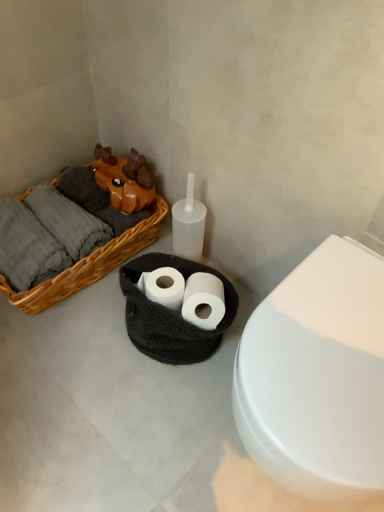
You are a GUI agent. You are given a task and a screenshot of the screen. Output one action in this format:
    pyautogui.click(x=<x>, y=<y>)
    Task: Click on the empty space that is ontop of black crocheted basket at center
    The image size is (384, 512).
    Given the screenshot: What is the action you would take?
    pyautogui.click(x=178, y=282)